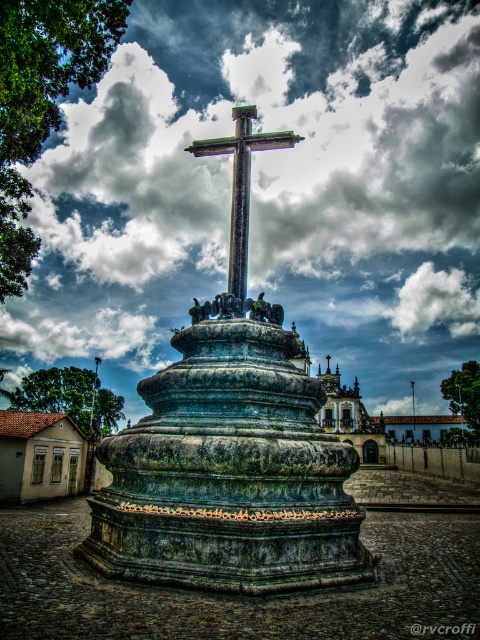
You are an architect assessing the structural integrity of the green stone cross at center. Considering the cloudy sky at upper center, which object is higher in the image?

The cloudy sky at upper center is taller than the green stone cross at center.

You are an architect examining the outdoor structure. You notice two crosses, the green stone cross at center and the polished stone cross at center. Which one is taller?

The green stone cross at center is taller than the polished stone cross at center according to the description.